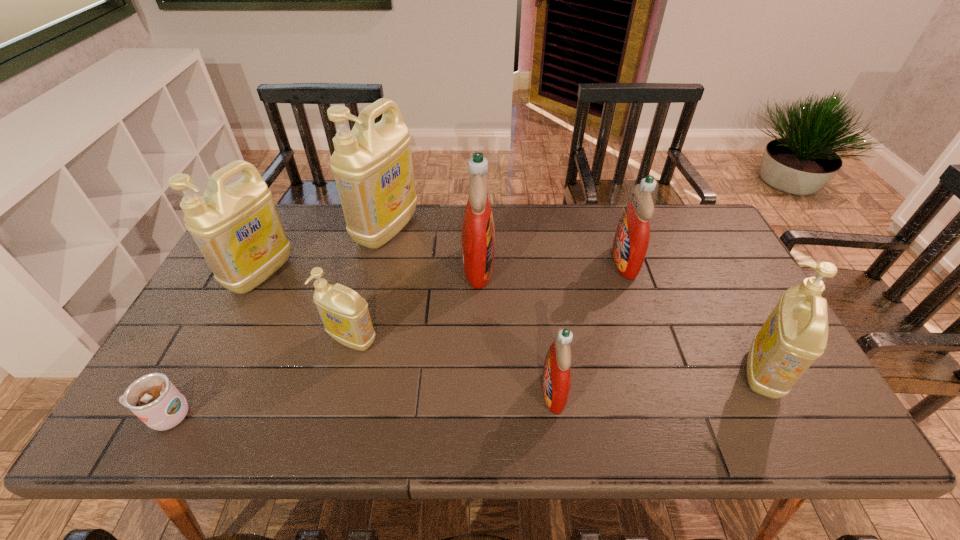
Where is `the biggest beige detergent`? the biggest beige detergent is located at coordinates (372, 164).

The width and height of the screenshot is (960, 540). I want to click on the tallest object, so click(372, 164).

Image resolution: width=960 pixels, height=540 pixels. What are the coordinates of `the leftmost beige detergent` in the screenshot? It's located at (237, 228).

The image size is (960, 540). Identify the location of the third smallest beige detergent. (237, 228).

This screenshot has height=540, width=960. What are the coordinates of `the fourth detergent from left to right` in the screenshot? It's located at (478, 232).

The height and width of the screenshot is (540, 960). In order to click on the biggest red detergent in this screenshot , I will do `click(478, 232)`.

At what (x,y) coordinates should I click in order to perform the action: click on the second object from right to left. Please return your answer as a coordinate pair (x, y). The width and height of the screenshot is (960, 540). Looking at the image, I should click on (631, 240).

The height and width of the screenshot is (540, 960). Identify the location of the rightmost red detergent. (631, 240).

Where is `the rightmost detergent`? the rightmost detergent is located at coordinates (795, 334).

At what (x,y) coordinates should I click in order to perform the action: click on the rightmost beige detergent. Please return your answer as a coordinate pair (x, y). Looking at the image, I should click on (795, 334).